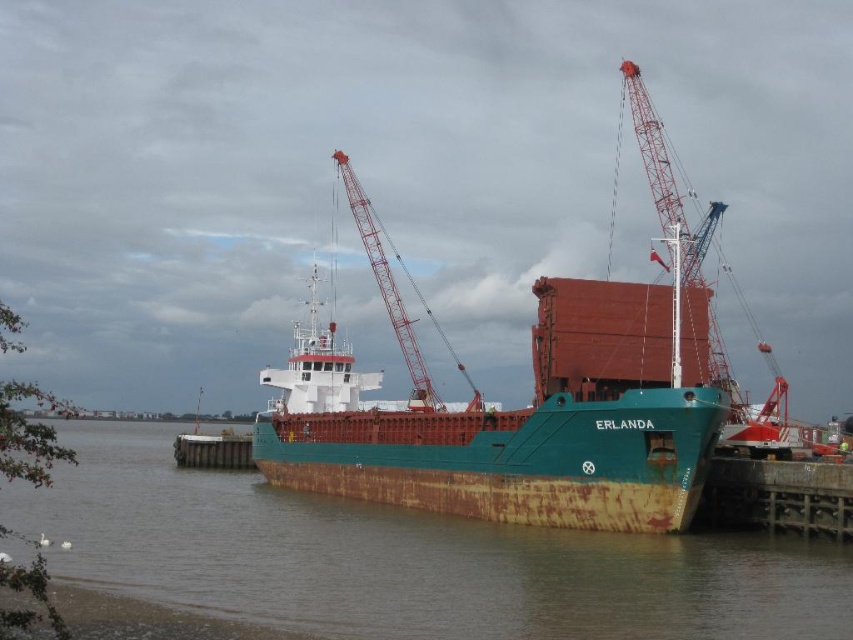
Question: Does red metal crane at upper center appear under rusty metal crane at center?

Choices:
 (A) no
 (B) yes

Answer: (A)

Question: Which point is farther from the camera taking this photo?

Choices:
 (A) (651, 144)
 (B) (433, 406)
 (C) (355, 592)

Answer: (B)

Question: Can you confirm if red metal crane at upper center is wider than rusty metal dock at lower right?

Choices:
 (A) yes
 (B) no

Answer: (A)

Question: Which of these objects is positioned farthest from the red metal crane at upper center?

Choices:
 (A) rusty metal dock at lower right
 (B) rusty metal crane at center

Answer: (B)

Question: Is rusty metal water at center further to camera compared to rusty metal ship at center?

Choices:
 (A) no
 (B) yes

Answer: (A)

Question: Which object is positioned farthest from the rusty metal crane at center?

Choices:
 (A) red metal crane at upper center
 (B) rusty metal dock at lower right
 (C) rusty metal ship at center
 (D) rusty metal water at center

Answer: (B)